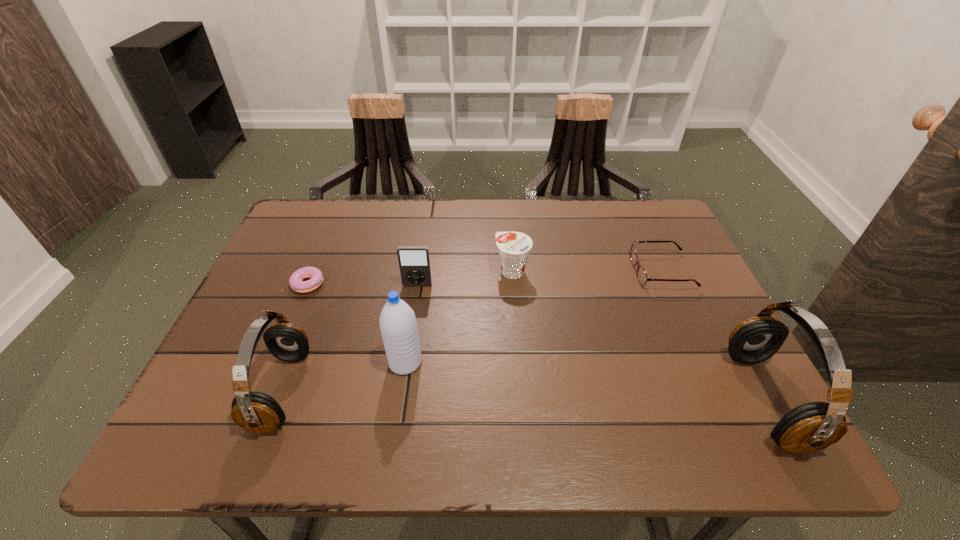
The width and height of the screenshot is (960, 540). Identify the location of water bottle present at the near edge. (398, 324).

The height and width of the screenshot is (540, 960). In order to click on headset at the left edge in this screenshot , I will do `click(257, 412)`.

At what (x,y) coordinates should I click in order to perform the action: click on doughnut present at the left edge. Please return your answer as a coordinate pair (x, y). Image resolution: width=960 pixels, height=540 pixels. Looking at the image, I should click on (296, 282).

This screenshot has height=540, width=960. I want to click on headset positioned at the right edge, so click(x=813, y=426).

Find the location of a particular element. The width and height of the screenshot is (960, 540). spectacles located in the right edge section of the desktop is located at coordinates point(642,277).

Identify the location of object located in the near left corner section of the desktop. (257, 412).

Locate an element on the screen. object that is at the near right corner is located at coordinates (813, 426).

This screenshot has height=540, width=960. Find the location of `vacant area at the far edge of the desktop`. vacant area at the far edge of the desktop is located at coordinates (576, 219).

Locate an element on the screen. Image resolution: width=960 pixels, height=540 pixels. vacant space at the near edge of the desktop is located at coordinates (351, 406).

In the image, there is a desktop. Where is `free space at the left edge`? free space at the left edge is located at coordinates (280, 299).